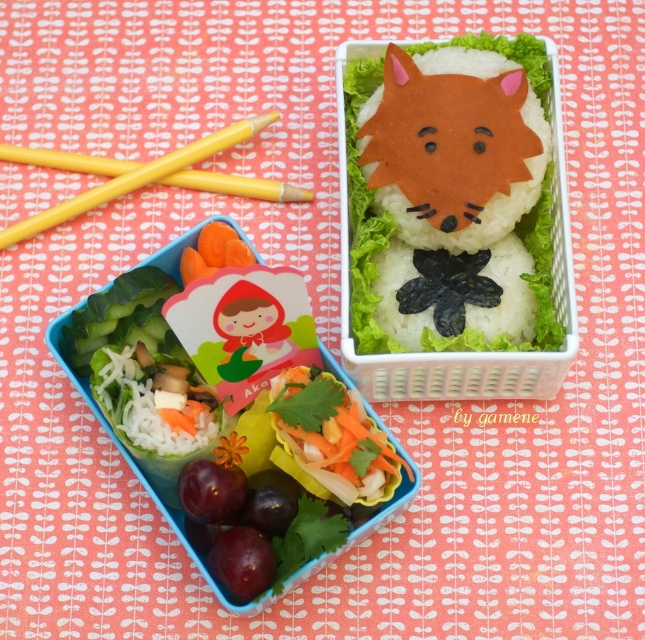
Can you confirm if orange matte rice fox at upper center is thinner than yellow plastic chopsticks at upper left?

Yes, orange matte rice fox at upper center is thinner than yellow plastic chopsticks at upper left.

Based on the photo, who is more distant from viewer, (439, 236) or (259, 180)?

The point (259, 180) is more distant.

Who is more forward, (519,131) or (253,115)?

Point (519,131)

The image size is (645, 640). I want to click on orange matte rice fox at upper center, so click(x=453, y=147).

Image resolution: width=645 pixels, height=640 pixels. What do you see at coordinates (468, 352) in the screenshot? I see `white rice with seaweed at upper center` at bounding box center [468, 352].

Identify the location of white rice with seaweed at upper center. (468, 352).

At what (x,y) coordinates should I click in order to perform the action: click on white rice with seaweed at upper center. Please return your answer as a coordinate pair (x, y). The height and width of the screenshot is (640, 645). Looking at the image, I should click on (468, 352).

The image size is (645, 640). What do you see at coordinates (181, 513) in the screenshot?
I see `fresh green salad at lower left` at bounding box center [181, 513].

Does fresh green salad at lower left appear over yellow wood chopsticks at upper left?

Actually, fresh green salad at lower left is below yellow wood chopsticks at upper left.

Which is in front, point (372, 528) or point (12, 147)?

Point (372, 528)

You are a GUI agent. You are given a task and a screenshot of the screen. Output one action in this format:
    pyautogui.click(x=<x>, y=<y>)
    Task: Click on the fresh green salad at lower left
    The image size is (645, 640).
    Given the screenshot: What is the action you would take?
    pyautogui.click(x=181, y=513)